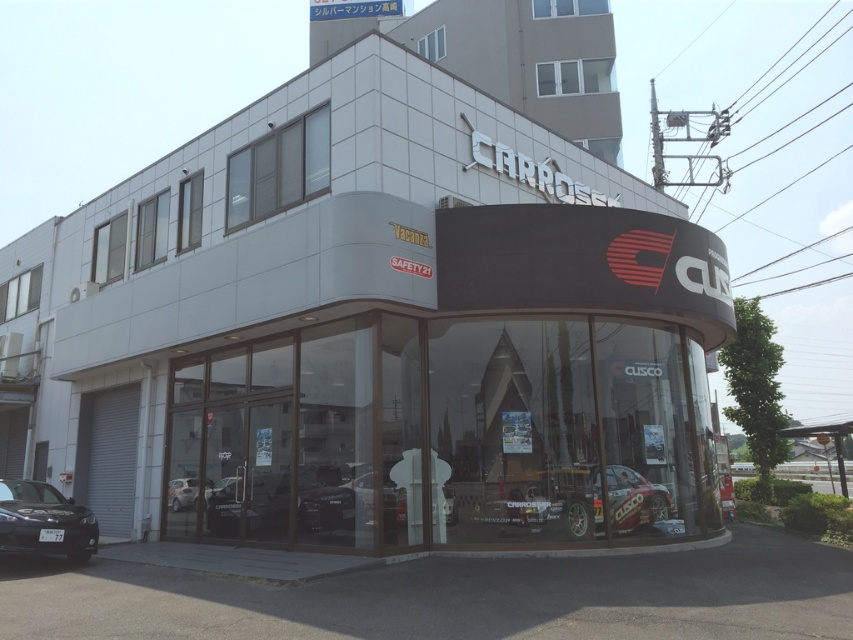
Question: Can you confirm if white matte building at center is wider than shiny silver car at center?

Choices:
 (A) yes
 (B) no

Answer: (A)

Question: In this image, where is matte black car at center located relative to satin black car at center?

Choices:
 (A) left
 (B) right

Answer: (B)

Question: Which point appears closest to the camera in this image?

Choices:
 (A) (350, 125)
 (B) (328, 497)

Answer: (A)

Question: Which of the following is the farthest from the observer?

Choices:
 (A) (171, 492)
 (B) (434, 280)
 (C) (65, 524)

Answer: (A)

Question: Can you confirm if white matte building at center is wider than shiny black car at lower left?

Choices:
 (A) yes
 (B) no

Answer: (A)

Question: Which of the following is the closest to the observer?

Choices:
 (A) satin black car at center
 (B) matte black car at center

Answer: (A)